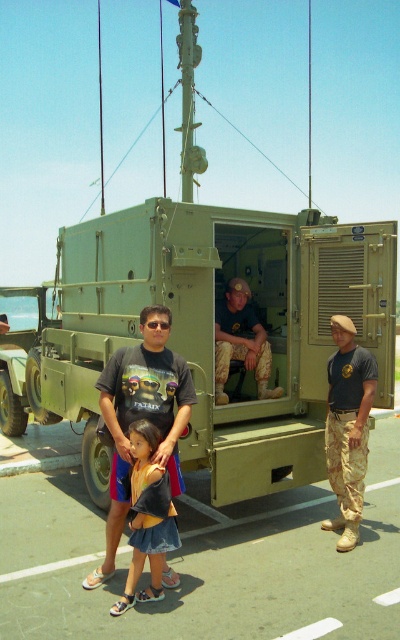
Question: Is matte green military truck at left to the right of camouflage fabric pants at center from the viewer's perspective?

Choices:
 (A) yes
 (B) no

Answer: (B)

Question: Which of the following is the farthest from the observer?

Choices:
 (A) (252, 362)
 (B) (159, 339)
 (C) (138, 500)
 (D) (375, 372)

Answer: (A)

Question: Which object is closer to the camera taking this photo?

Choices:
 (A) dark gray t-shirt at center
 (B) camouflage pants at right

Answer: (A)

Question: Considering the relative positions of camouflage pants at right and denim skirt at lower center in the image provided, where is camouflage pants at right located with respect to denim skirt at lower center?

Choices:
 (A) left
 (B) right

Answer: (B)

Question: Does dark gray t-shirt at center have a larger size compared to matte green military truck at left?

Choices:
 (A) no
 (B) yes

Answer: (A)

Question: Which object is positioned closest to the camouflage pants at right?

Choices:
 (A) denim skirt at lower center
 (B) camouflage fabric pants at center

Answer: (B)